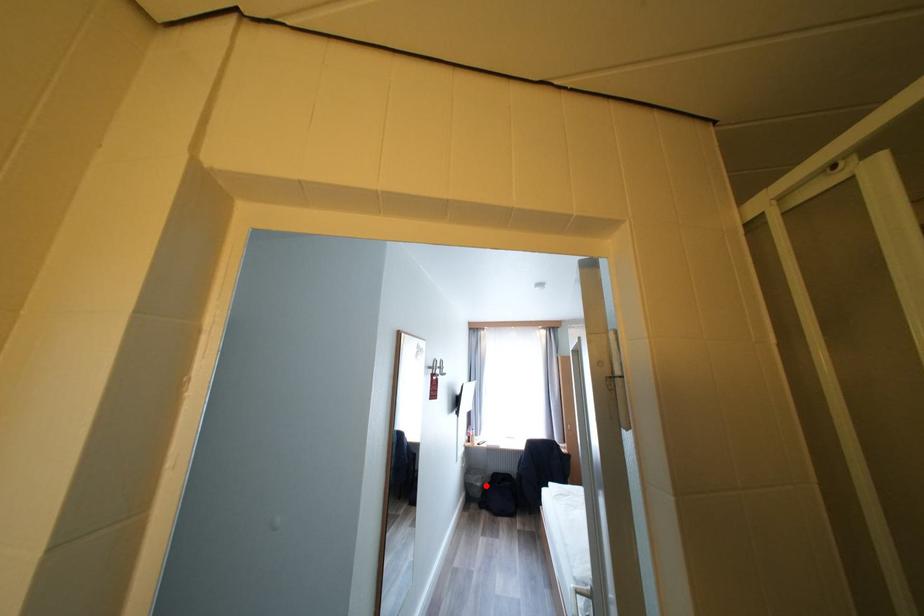
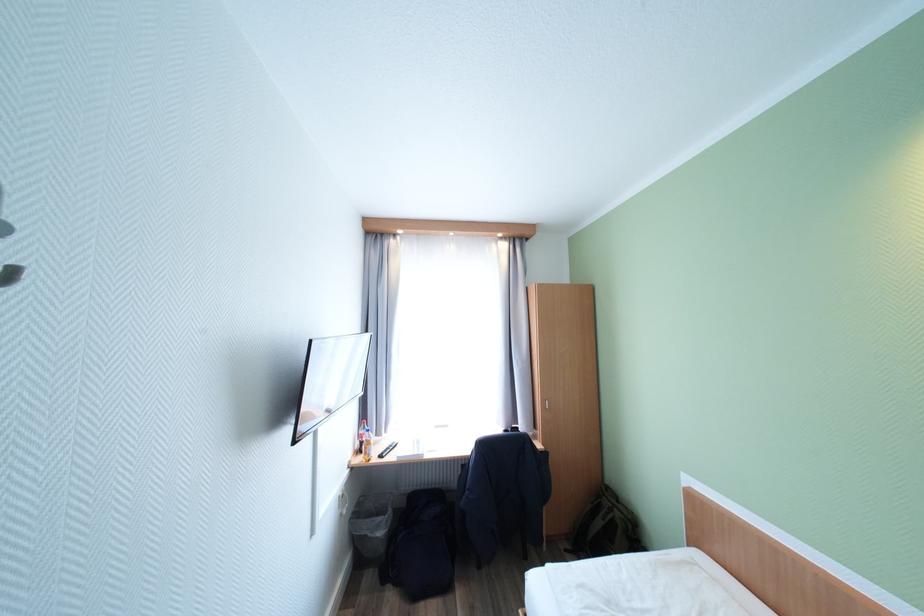
Question: I am providing you with two images of the same scene from different viewpoints. A red point is shown in image1. For the corresponding object point in image2, is it positioned nearer or farther from the camera?

Choices:
 (A) Nearer
 (B) Farther

Answer: (A)